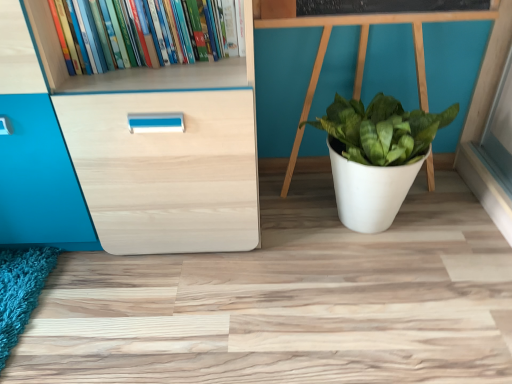
Question: Does hardcover books at upper left have a larger size compared to white matte pot at center?

Choices:
 (A) no
 (B) yes

Answer: (A)

Question: From a real-world perspective, is hardcover books at upper left positioned under white matte pot at center based on gravity?

Choices:
 (A) no
 (B) yes

Answer: (A)

Question: Is hardcover books at upper left oriented away from white matte pot at center?

Choices:
 (A) no
 (B) yes

Answer: (A)

Question: Does hardcover books at upper left appear on the left side of white matte pot at center?

Choices:
 (A) yes
 (B) no

Answer: (A)

Question: From the image's perspective, is hardcover books at upper left beneath white matte pot at center?

Choices:
 (A) no
 (B) yes

Answer: (A)

Question: Is hardcover books at upper left located outside white matte pot at center?

Choices:
 (A) yes
 (B) no

Answer: (A)

Question: Is white matte pot at center positioned beyond the bounds of hardcover books at upper left?

Choices:
 (A) no
 (B) yes

Answer: (B)

Question: Is white matte pot at center looking in the opposite direction of hardcover books at upper left?

Choices:
 (A) yes
 (B) no

Answer: (B)

Question: Is there a large distance between white matte pot at center and hardcover books at upper left?

Choices:
 (A) yes
 (B) no

Answer: (B)

Question: Can you see white matte pot at center touching hardcover books at upper left?

Choices:
 (A) yes
 (B) no

Answer: (B)

Question: Is white matte pot at center bigger than hardcover books at upper left?

Choices:
 (A) yes
 (B) no

Answer: (A)

Question: Does white matte pot at center have a greater height compared to hardcover books at upper left?

Choices:
 (A) no
 (B) yes

Answer: (B)

Question: Based on their sizes in the image, would you say white matte pot at center is bigger or smaller than hardcover books at upper left?

Choices:
 (A) small
 (B) big

Answer: (B)